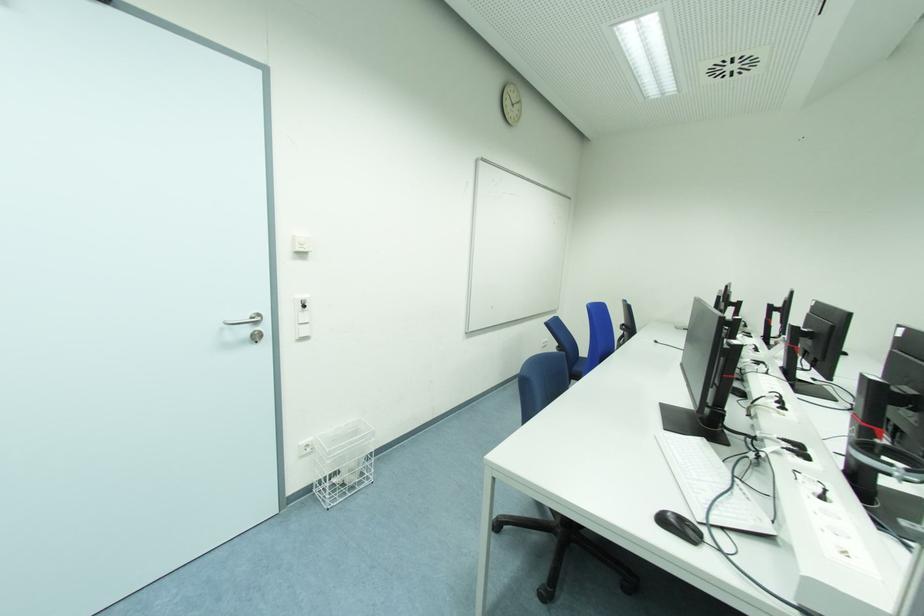
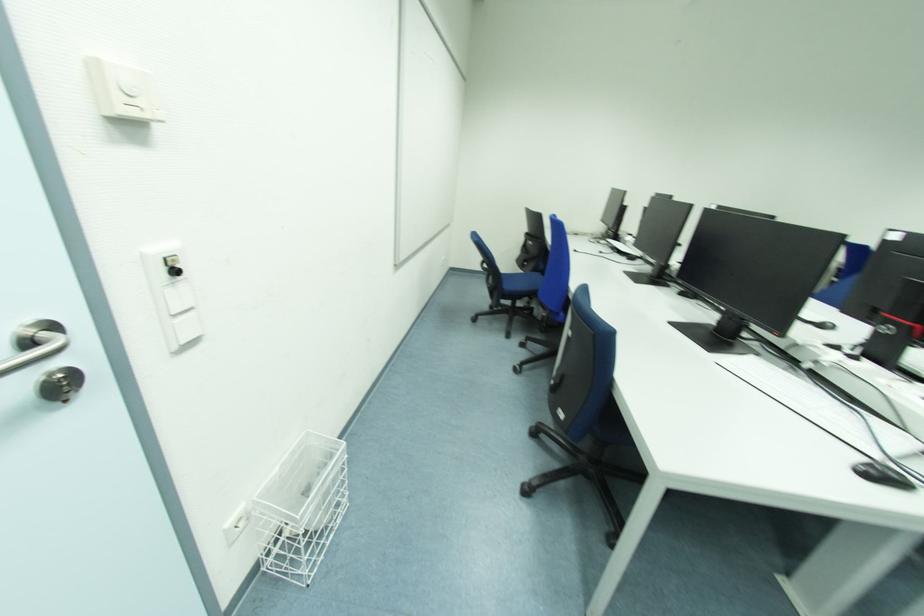
In the second image, find the point that corresponds to (x=258, y=333) in the first image.

(55, 375)